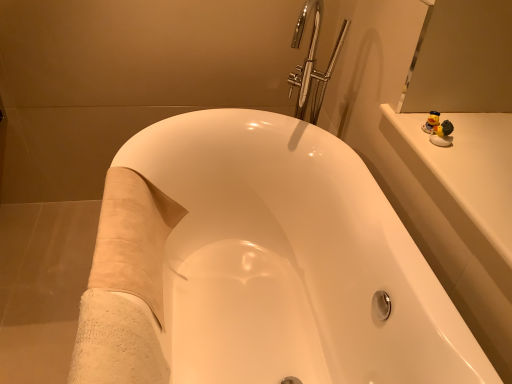
Find the location of a particular element. empty space that is ontop of white glossy countertop at upper right (from a real-world perspective) is located at coordinates (475, 145).